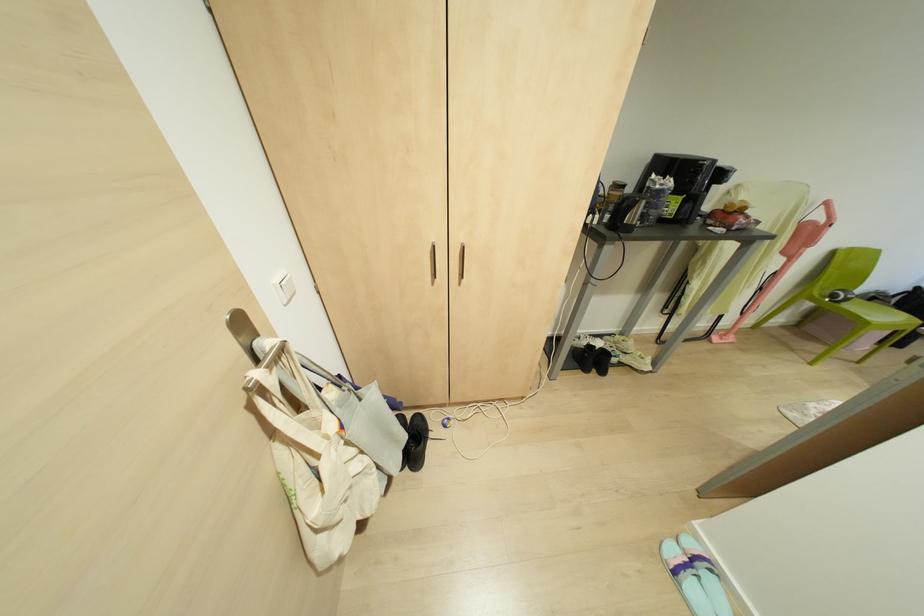
Describe the element at coordinates (819, 219) in the screenshot. I see `the pink vacuum handle` at that location.